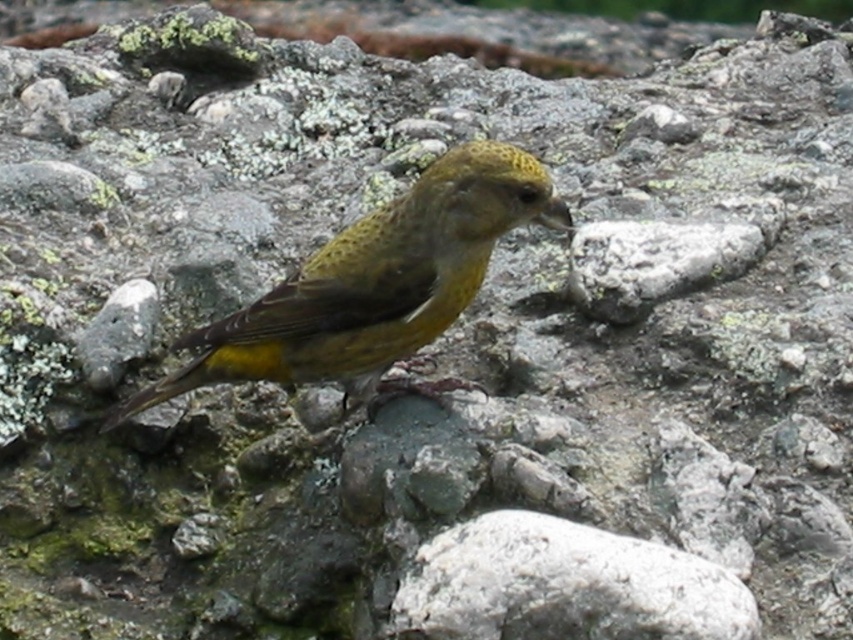
Question: Can you confirm if greenish-yellow feathers at center is wider than white rough rock at center?

Choices:
 (A) no
 (B) yes

Answer: (B)

Question: Which object appears farthest from the camera in this image?

Choices:
 (A) white rough rock at center
 (B) greenish-yellow feathers at center

Answer: (B)

Question: From the image, what is the correct spatial relationship of greenish-yellow feathers at center in relation to white rough rock at center?

Choices:
 (A) above
 (B) below

Answer: (A)

Question: Can you confirm if greenish-yellow feathers at center is bigger than white rough rock at center?

Choices:
 (A) no
 (B) yes

Answer: (B)